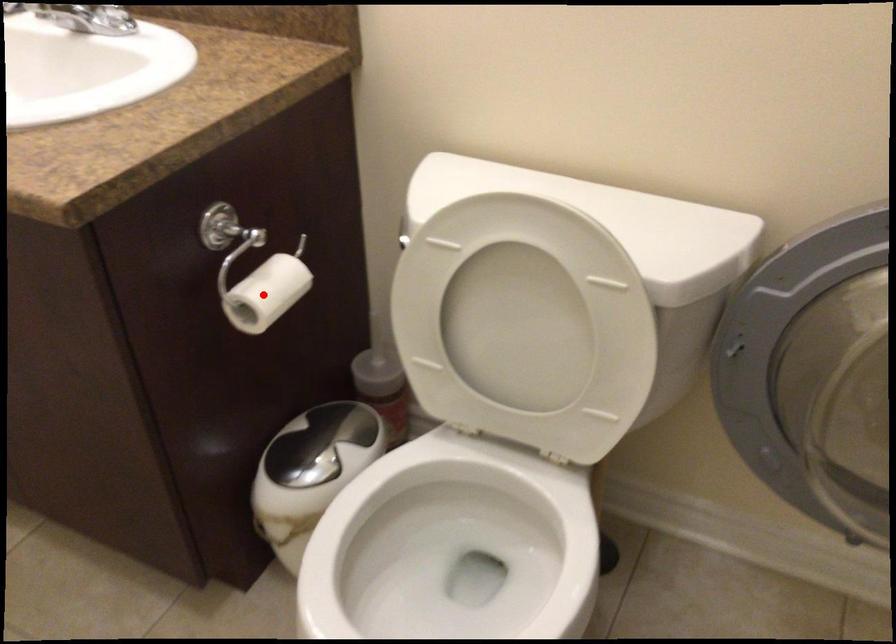
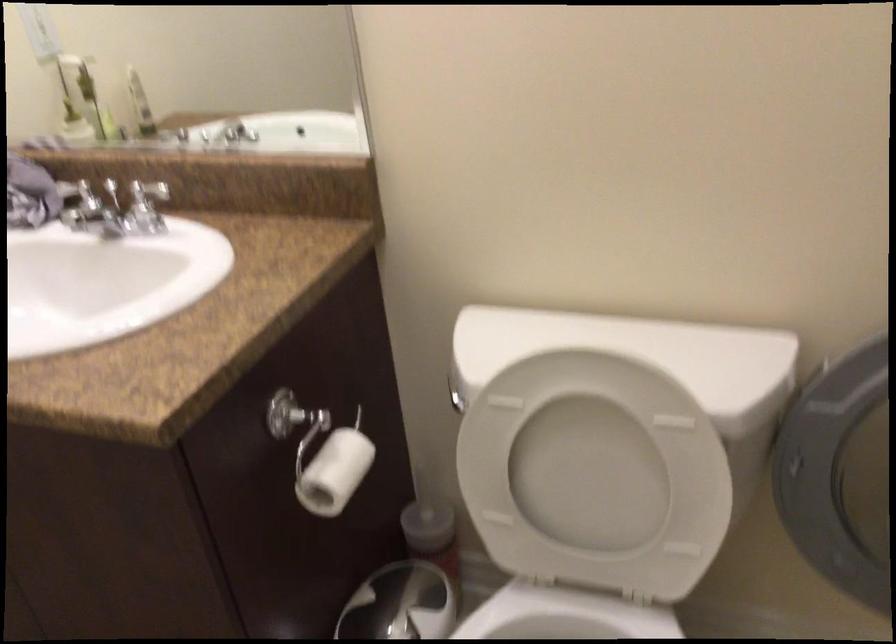
Where in the second image is the point corresponding to the highlighted location from the first image?

(334, 471)